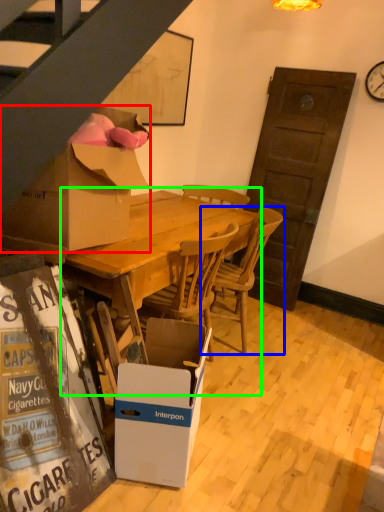
Question: Considering the real-world distances, which object is farthest from box (highlighted by a red box)? chair (highlighted by a blue box) or round table (highlighted by a green box)?

Choices:
 (A) chair
 (B) round table

Answer: (A)